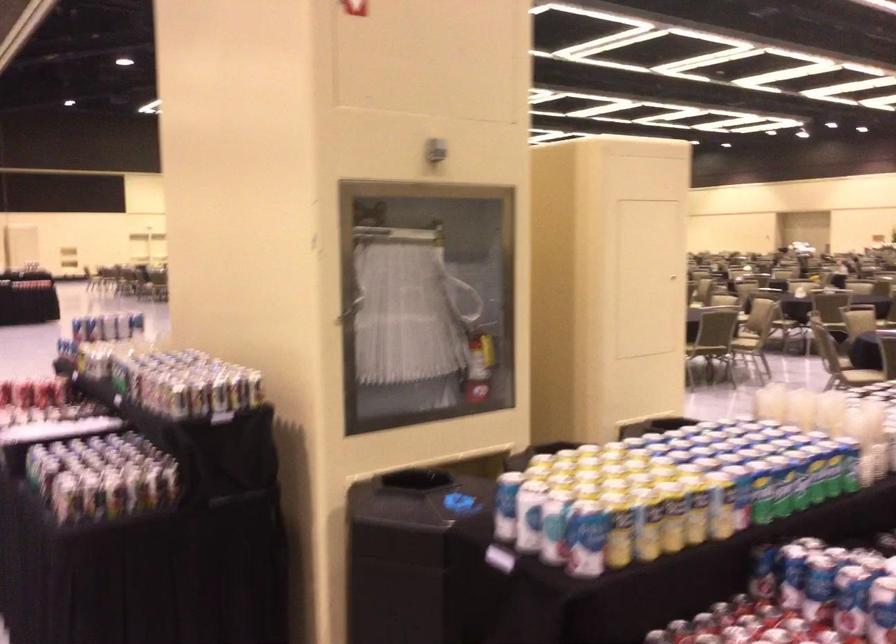
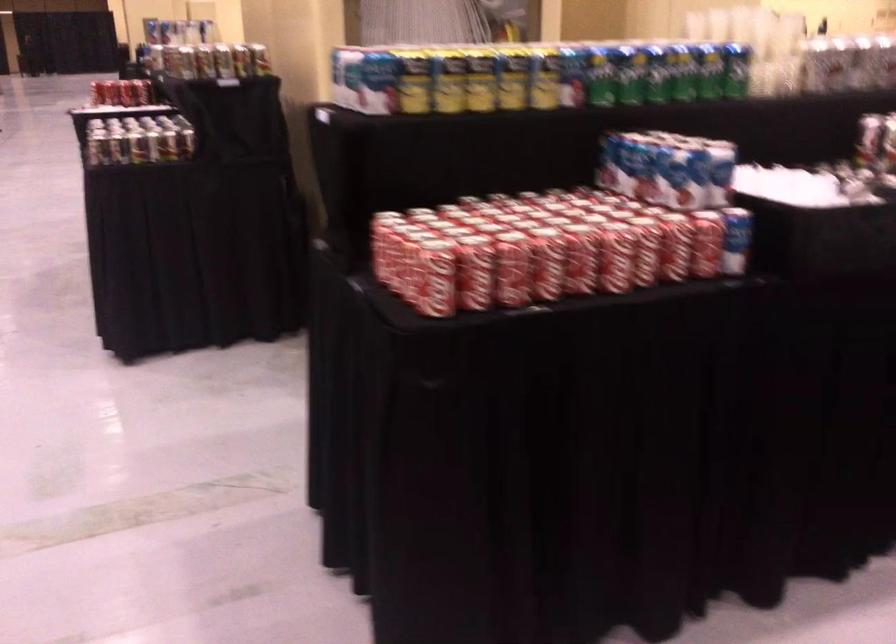
Question: Based on the continuous images, in which direction is the camera rotating? Reply with the corresponding letter.

Choices:
 (A) Left
 (B) Right
 (C) Up
 (D) Down

Answer: (D)